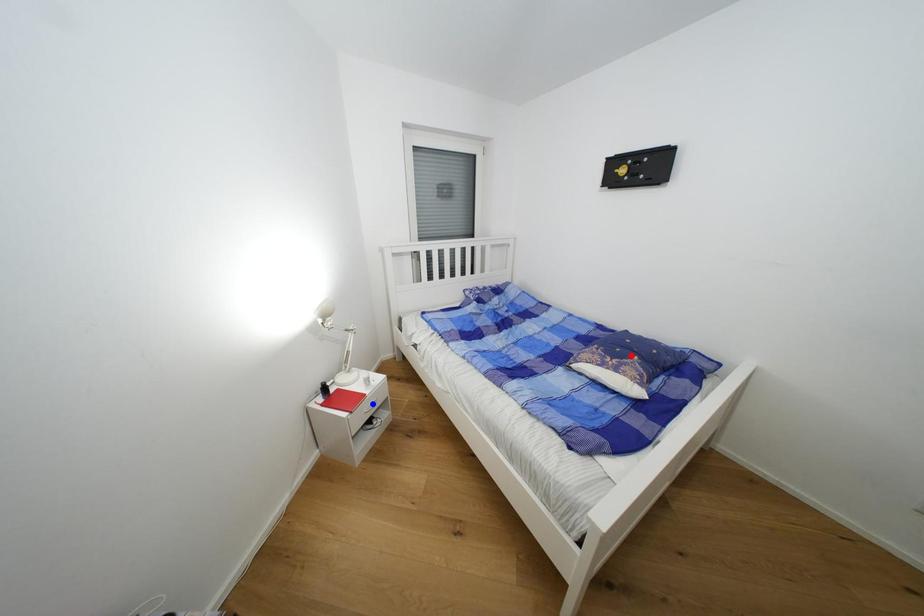
Question: In the image, two points are highlighted. Which point is nearer to the camera? Reply with the corresponding letter.

Choices:
 (A) blue point
 (B) red point

Answer: (B)